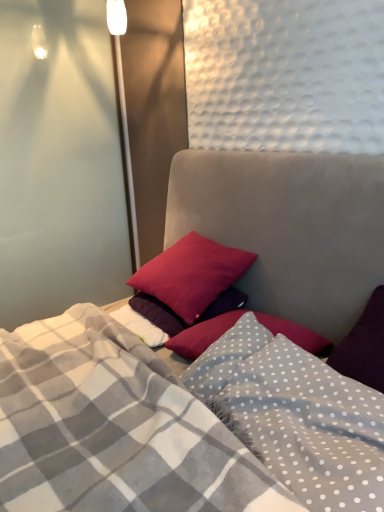
Question: Is gray polka dot blanket at center taller or shorter than velvet-like pillows at center?

Choices:
 (A) tall
 (B) short

Answer: (B)

Question: In the image, is gray polka dot blanket at center positioned in front of or behind velvet-like pillows at center?

Choices:
 (A) front
 (B) behind

Answer: (B)

Question: Which of these objects is positioned farthest from the transparent glass door at left?

Choices:
 (A) matte red pillow at center, acting as the 1th pillow starting from the bottom
 (B) gray polka dot blanket at center
 (C) velvet-like pillows at center
 (D) matte red pillow at center, arranged as the second pillow when ordered from the bottom

Answer: (B)

Question: Estimate the real-world distances between objects in this image. Which object is closer to the transparent glass door at left?

Choices:
 (A) velvet-like pillows at center
 (B) gray polka dot blanket at center
 (C) matte red pillow at center, which is the 1th pillow from top to bottom
 (D) matte red pillow at center, acting as the second pillow starting from the top

Answer: (C)